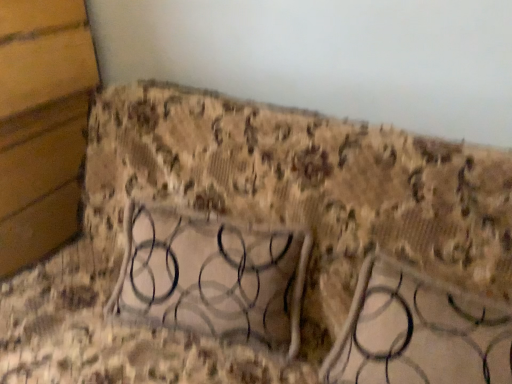
Question: Considering the relative sizes of metallic silver table at center and metallic textured frame at lower left in the image provided, is metallic silver table at center shorter than metallic textured frame at lower left?

Choices:
 (A) yes
 (B) no

Answer: (A)

Question: From a real-world perspective, is metallic silver table at center under metallic textured frame at lower left?

Choices:
 (A) no
 (B) yes

Answer: (B)

Question: Is metallic silver table at center aimed at metallic textured frame at lower left?

Choices:
 (A) no
 (B) yes

Answer: (A)

Question: Can you confirm if metallic silver table at center is thinner than metallic textured frame at lower left?

Choices:
 (A) no
 (B) yes

Answer: (B)

Question: From the image's perspective, would you say metallic silver table at center is shown under metallic textured frame at lower left?

Choices:
 (A) no
 (B) yes

Answer: (B)

Question: Is metallic silver table at center outside metallic textured frame at lower left?

Choices:
 (A) no
 (B) yes

Answer: (B)

Question: Does metallic textured frame at lower left come in front of metallic silver table at center?

Choices:
 (A) yes
 (B) no

Answer: (B)

Question: Is metallic textured frame at lower left at the right side of metallic silver table at center?

Choices:
 (A) no
 (B) yes

Answer: (A)

Question: From a real-world perspective, is metallic textured frame at lower left beneath metallic silver table at center?

Choices:
 (A) no
 (B) yes

Answer: (A)

Question: From the image's perspective, would you say metallic textured frame at lower left is shown under metallic silver table at center?

Choices:
 (A) no
 (B) yes

Answer: (A)

Question: Can you confirm if metallic textured frame at lower left is shorter than metallic silver table at center?

Choices:
 (A) yes
 (B) no

Answer: (B)

Question: Can you confirm if metallic textured frame at lower left is taller than metallic silver table at center?

Choices:
 (A) yes
 (B) no

Answer: (A)

Question: Is metallic silver table at center wider or thinner than metallic textured frame at lower left?

Choices:
 (A) thin
 (B) wide

Answer: (A)